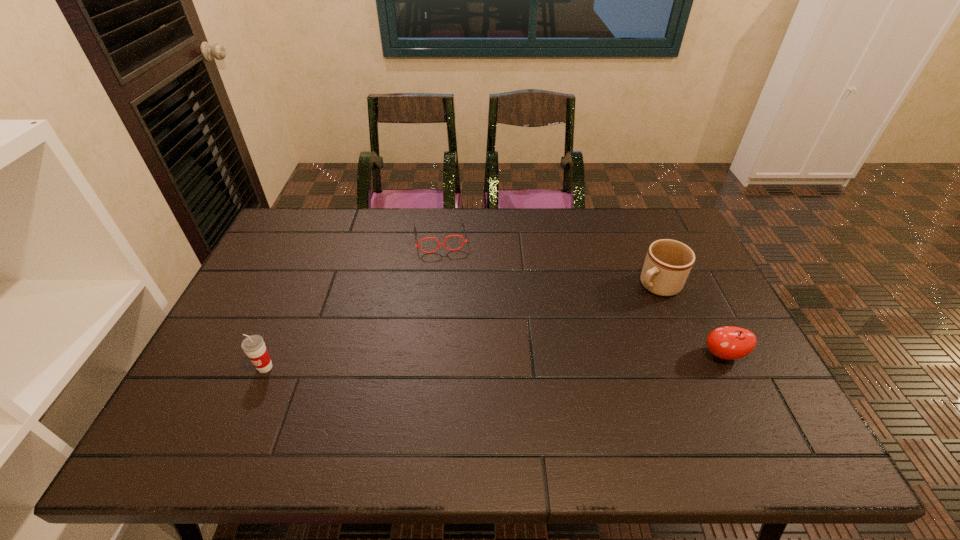
Where is `vacant space on the desktop that is between the leftmost object and the apple and is positioned on the front-facing side of the farthest object`? This screenshot has height=540, width=960. vacant space on the desktop that is between the leftmost object and the apple and is positioned on the front-facing side of the farthest object is located at coordinates (459, 362).

This screenshot has width=960, height=540. What are the coordinates of `free space on the desktop that is between the cup and the apple and is positioned on the side of the third nearest object with the handle` in the screenshot? It's located at pyautogui.click(x=550, y=360).